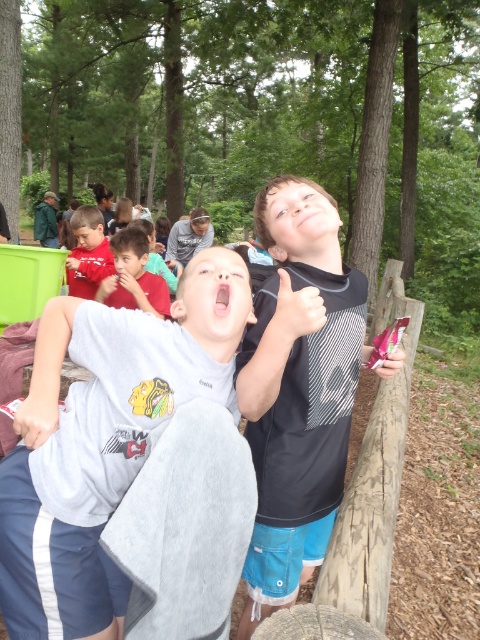
Question: Which point is farther to the camera?

Choices:
 (A) (244, 337)
 (B) (103, 224)
 (C) (85, 342)
 (D) (154, 308)

Answer: (B)

Question: Which of these objects is positioned farthest from the matte red shirt at upper left?

Choices:
 (A) matte black shirt at upper right
 (B) gray cotton shirt at center
 (C) matte red shirt at center

Answer: (B)

Question: Can you confirm if gray cotton shirt at center is positioned to the right of matte red shirt at center?

Choices:
 (A) yes
 (B) no

Answer: (A)

Question: Which point is closer to the camera?

Choices:
 (A) matte black shirt at upper right
 (B) matte red shirt at center
 (C) gray cotton shirt at center

Answer: (A)

Question: Does matte black shirt at upper right appear under matte red shirt at center?

Choices:
 (A) yes
 (B) no

Answer: (A)

Question: Does matte black shirt at upper right appear on the left side of matte red shirt at center?

Choices:
 (A) yes
 (B) no

Answer: (B)